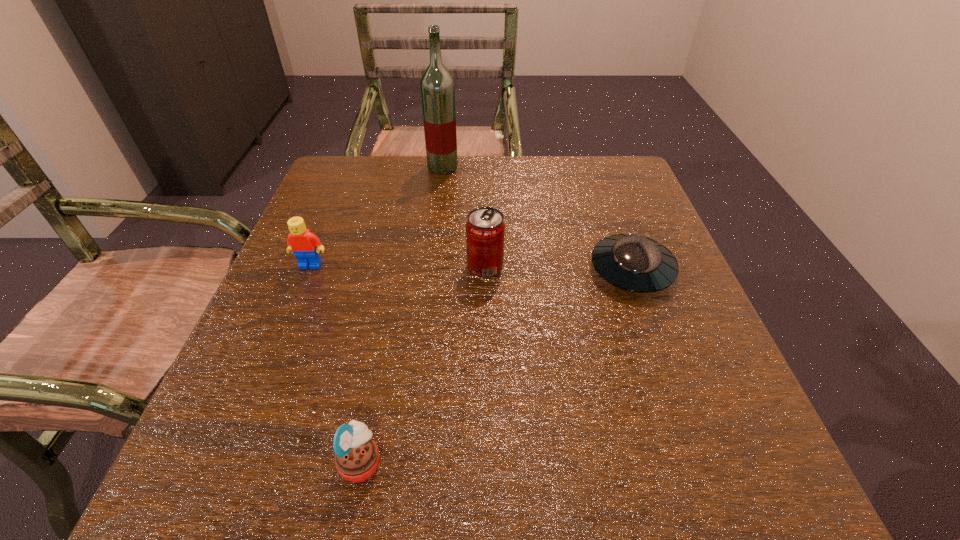
Identify the location of vacant space that is in between the leftmost object and the second object from right to left. This screenshot has width=960, height=540. (397, 266).

Identify the location of free space between the liquor and the fourth tallest object. This screenshot has width=960, height=540. (402, 314).

I want to click on vacant region between the pop soda and the farthest object, so click(x=464, y=217).

Locate an element on the screen. The height and width of the screenshot is (540, 960). object that is the closest to the Lego is located at coordinates click(485, 229).

At what (x,y) coordinates should I click in order to perform the action: click on the fourth closest object to the pop soda. Please return your answer as a coordinate pair (x, y). Looking at the image, I should click on (356, 456).

Find the location of a particular element. Image resolution: width=960 pixels, height=540 pixels. free point that satisfies the following two spatial constraints: 1. on the front side of the liquor; 2. on the right side of the rightmost object is located at coordinates (431, 270).

This screenshot has width=960, height=540. Identify the location of vacant area that satisfies the following two spatial constraints: 1. on the front side of the pop soda; 2. on the front-facing side of the nearest object. (488, 462).

Locate an element on the screen. vacant space that satisfies the following two spatial constraints: 1. on the front side of the tallest object; 2. on the right side of the pop soda is located at coordinates (431, 267).

You are a GUI agent. You are given a task and a screenshot of the screen. Output one action in this format:
    pyautogui.click(x=<x>, y=<y>)
    Task: Click on the free spot that satisfies the following two spatial constraints: 1. on the face of the shortest object; 2. on the left side of the Lego
    The width and height of the screenshot is (960, 540).
    Given the screenshot: What is the action you would take?
    pyautogui.click(x=308, y=270)